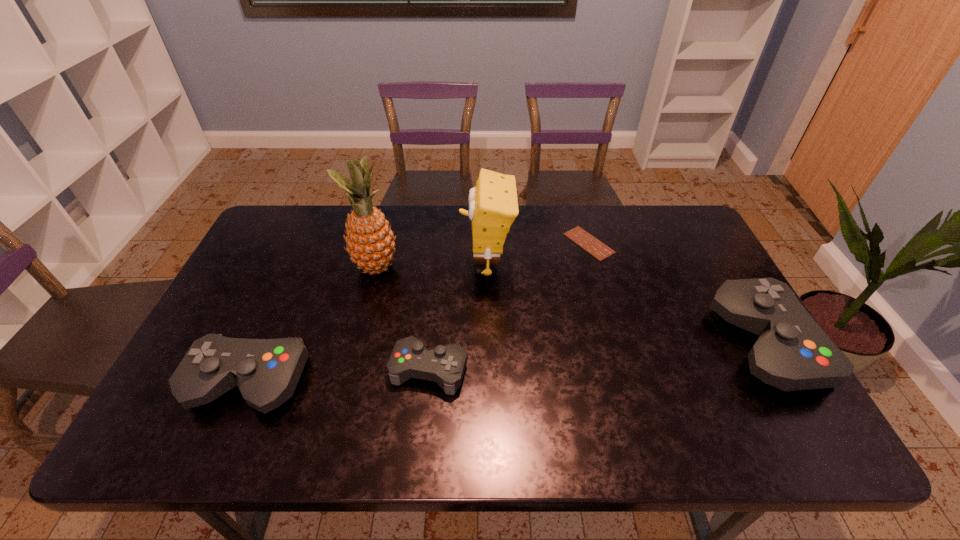
Locate which control ranks second in proximity to the second tallest control. Please provide its 2D coordinates. Your answer should be formatted as a tuple, i.e. [(x, y)], where the tuple contains the x and y coordinates of a point satisfying the conditions above.

[(792, 353)]